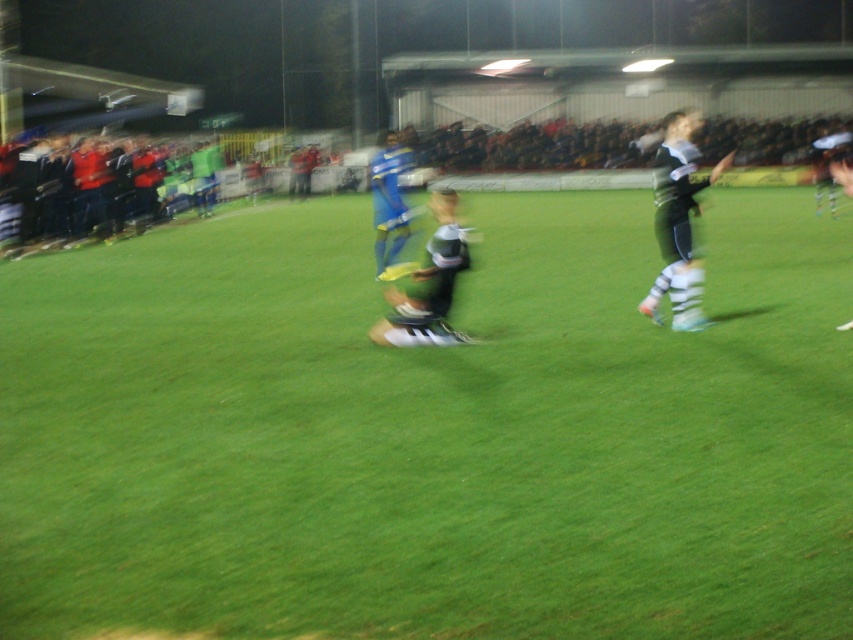
Based on the photo, you are a photographer trying to capture a photo of the soccer match. You want to ensure both the green grass at center and the green jersey at center are clearly visible in the frame. Given their distance apart, will you need to adjust your camera focus to include both in sharp focus?

The green grass at center and green jersey at center are 8.91 feet apart from each other. To capture both in sharp focus, you may need to adjust the camera focus or use a smaller aperture to increase depth of field, as the distance between them requires a sufficient depth of field to keep both elements in focus.

You are a soccer coach analyzing the field layout. You notice the green grass at center and the green jersey at center. Which one has a greater width in the image?

The green grass at center has a greater width than the green jersey at center.

From the picture: You are a drone operator trying to capture a close shot of the soccer ball during the match. The soccer ball is located at the point marked by point (430, 432). To avoid obstruction, you need to ensure that the drone flies above the green grass at center. Is the soccer ball positioned on the green grass at center?

The soccer ball is located at point (430, 432), which is the same as the point representing the green grass at center. Therefore, the soccer ball is positioned on the green grass at center.